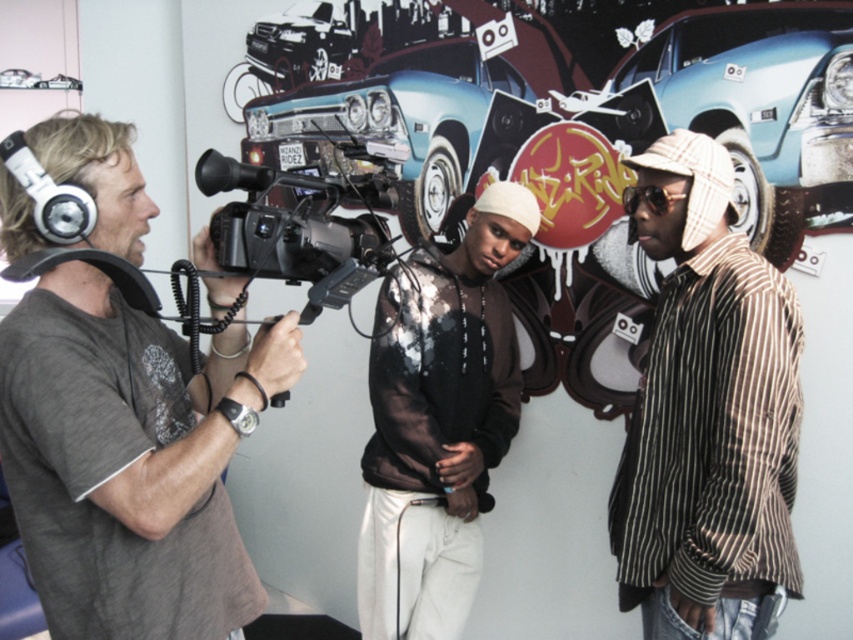
Question: Which of the following is the farthest from the observer?

Choices:
 (A) gray cotton t-shirt at left
 (B) white matte headphones at left

Answer: (B)

Question: Is striped cotton shirt at right wider than shiny black car at upper center?

Choices:
 (A) yes
 (B) no

Answer: (B)

Question: Is striped cotton shirt at right wider than light blue metallic car at upper right?

Choices:
 (A) yes
 (B) no

Answer: (B)

Question: Which object appears closest to the camera in this image?

Choices:
 (A) light blue metallic car at upper right
 (B) black plastic video camera at center
 (C) shiny black car at upper center
 (D) striped cotton shirt at right

Answer: (B)

Question: Is light blue metallic car at upper right closer to the viewer compared to black plastic video camera at center?

Choices:
 (A) no
 (B) yes

Answer: (A)

Question: Which object is the farthest from the striped cotton shirt at right?

Choices:
 (A) gray cotton t-shirt at left
 (B) black sheer hoodie at center
 (C) light blue metallic car at upper right

Answer: (A)